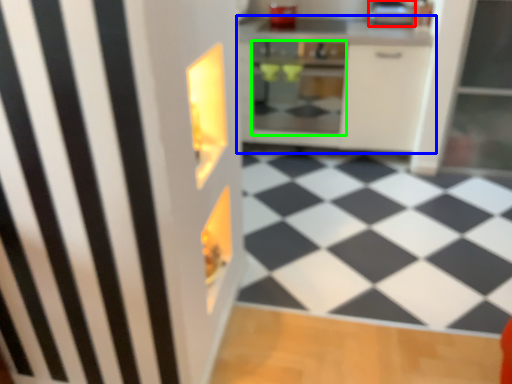
Question: Considering the real-world distances, which object is farthest from appliance (highlighted by a red box)? cabinetry (highlighted by a blue box) or oven (highlighted by a green box)?

Choices:
 (A) cabinetry
 (B) oven

Answer: (B)